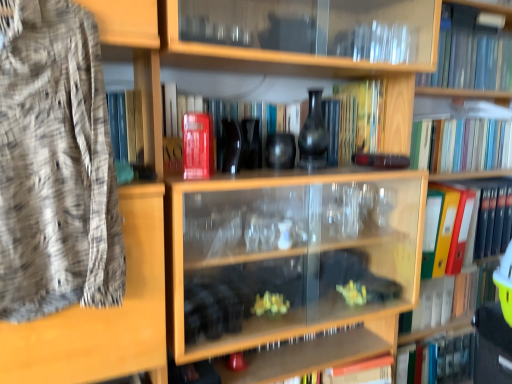
Find the location of a particular element. free space above transparent glass cabinet at lower center (from a real-world perspective) is located at coordinates (316, 364).